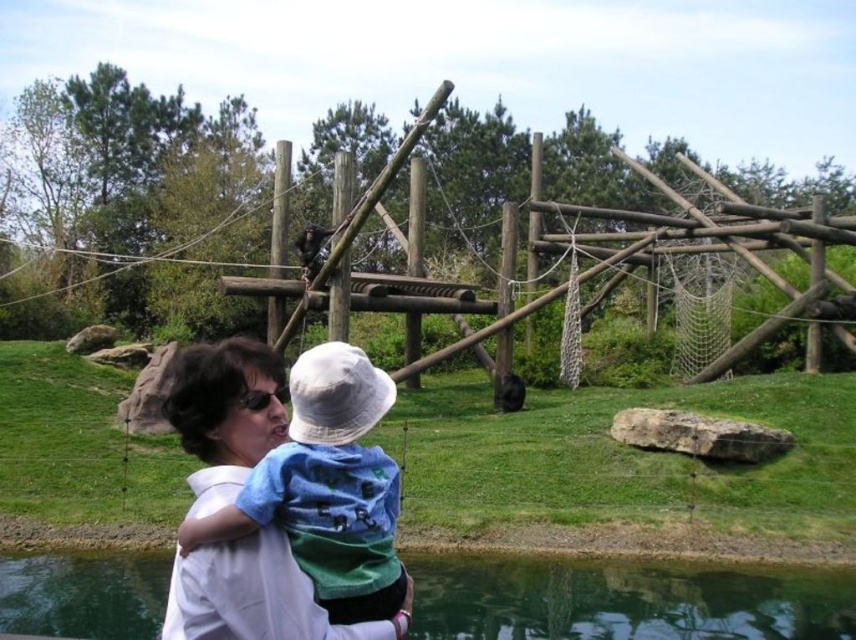
Question: Which point is closer to the camera taking this photo?

Choices:
 (A) (690, 170)
 (B) (140, 561)
 (C) (268, 550)

Answer: (C)

Question: Which point is farther from the camera taking this photo?

Choices:
 (A) (563, 600)
 (B) (300, 595)

Answer: (A)

Question: Can you confirm if wooden at upper center is smaller than clear water at lower center?

Choices:
 (A) no
 (B) yes

Answer: (A)

Question: Which object is positioned farthest from the clear water at lower center?

Choices:
 (A) wooden at upper center
 (B) blue cotton shirt at center

Answer: (A)

Question: Can you confirm if clear water at lower center is bigger than blue cotton shirt at center?

Choices:
 (A) no
 (B) yes

Answer: (B)

Question: Is clear water at lower center bigger than blue cotton shirt at center?

Choices:
 (A) yes
 (B) no

Answer: (A)